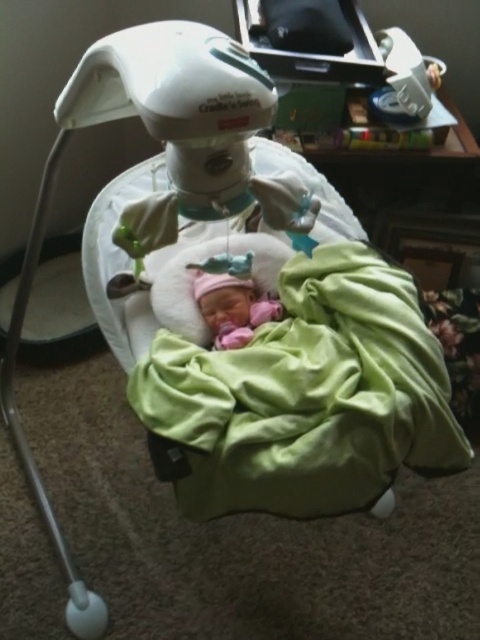
You are a parent checking on your baby in the Fisher Price Cradle n Swing. You notice the green soft blanket at center and the pink fabric newborn at center. Which item is closer to you when you look at the swing?

The green soft blanket at center is closer to you because it is in front of the pink fabric newborn at center.